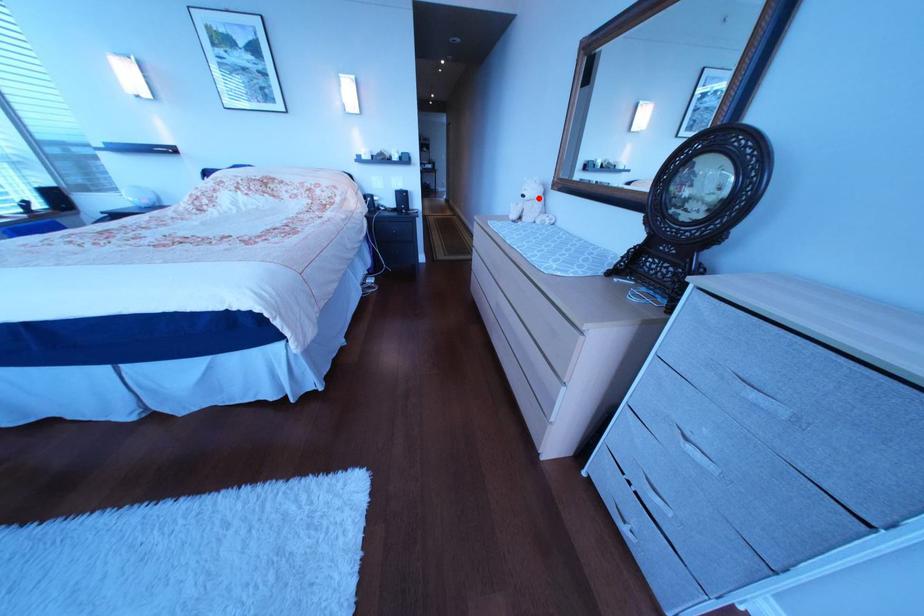
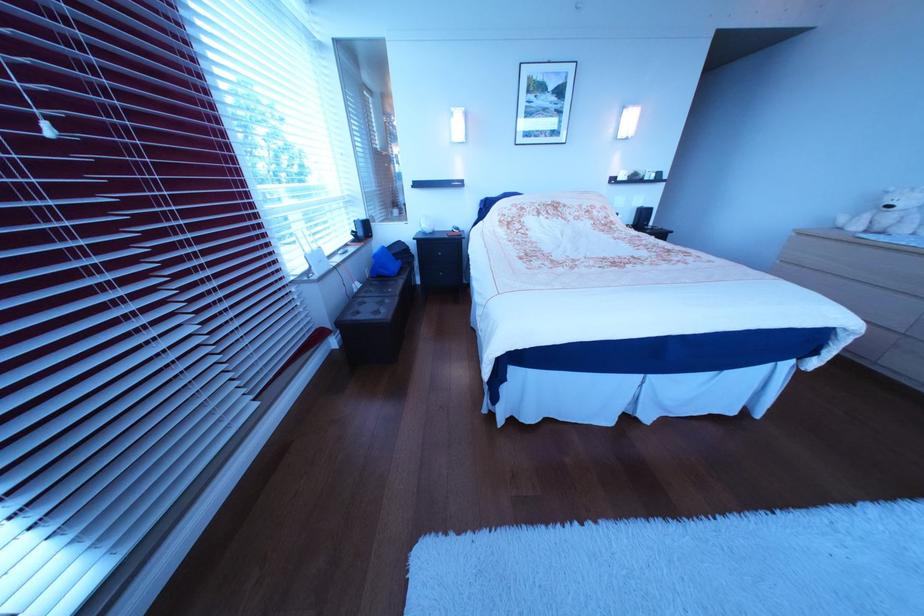
In the second image, find the point that corresponds to the highlighted location in the first image.

(906, 209)